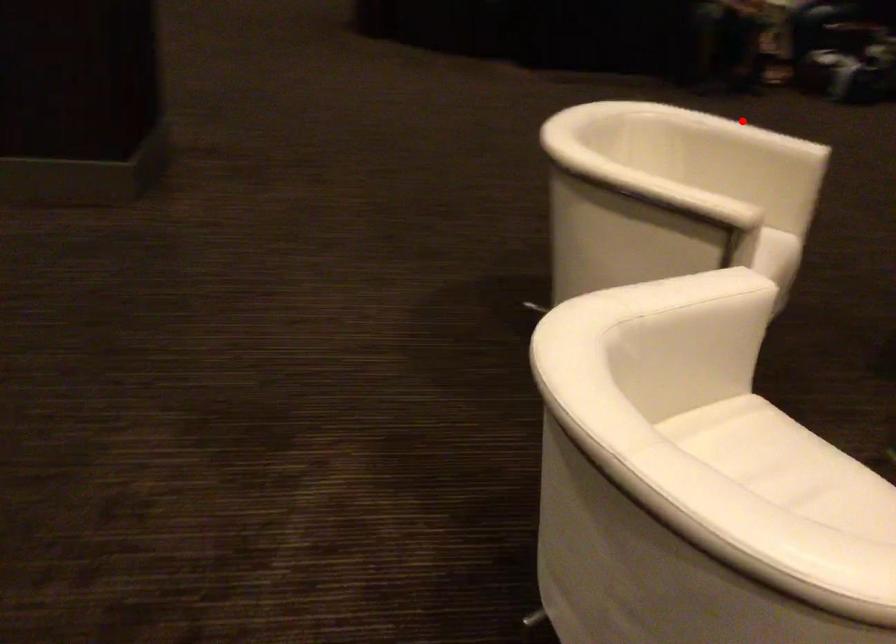
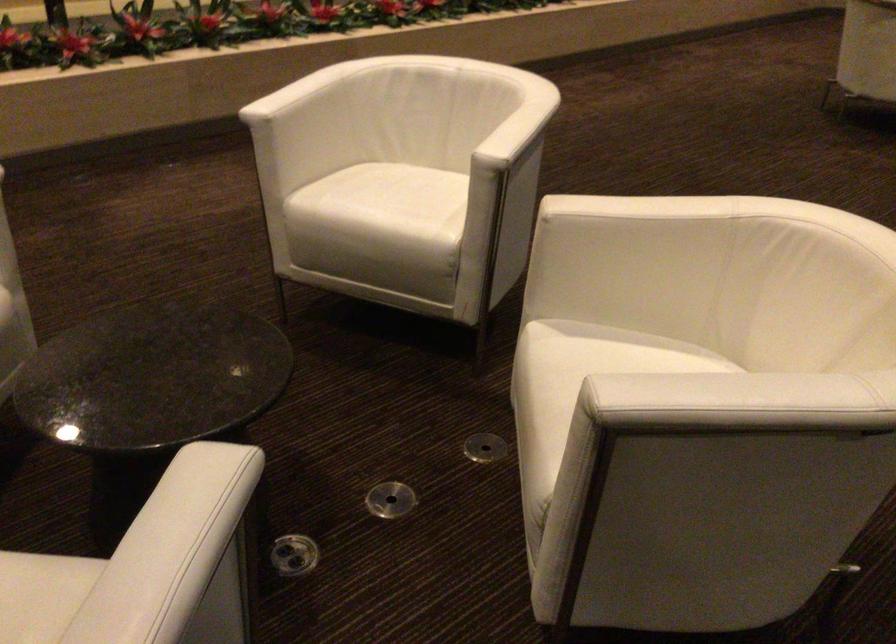
Question: I am providing you with two images of the same scene from different viewpoints. A red point is marked on the first image. Is the red point's position out of view in image 2?

Choices:
 (A) Yes
 (B) No

Answer: (B)